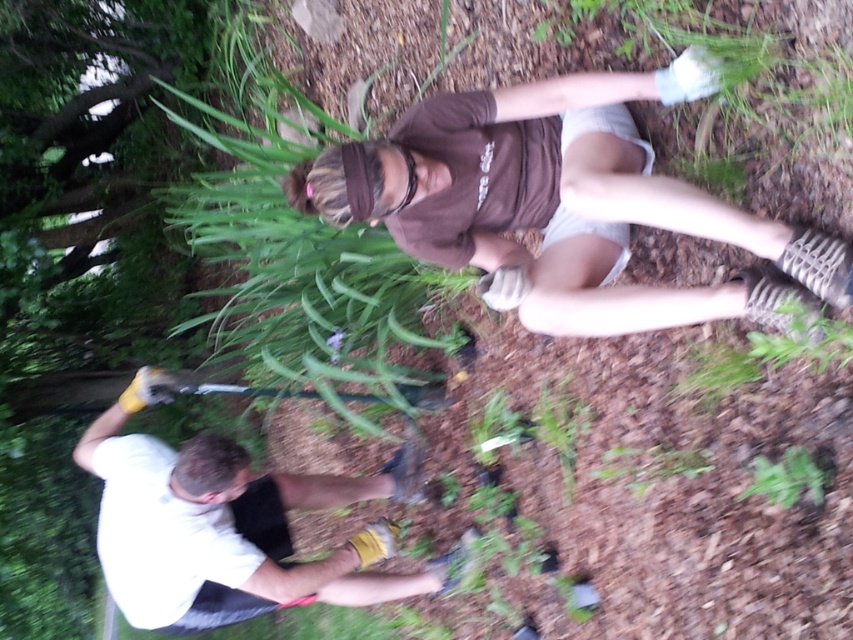
Question: Which object is farther from the camera taking this photo?

Choices:
 (A) white matte shirt at lower left
 (B) brown cotton shirt at upper center
 (C) green leafy plant at lower right

Answer: (A)

Question: Is brown cotton shirt at upper center behind white matte shirt at lower left?

Choices:
 (A) no
 (B) yes

Answer: (A)

Question: Which object is farther from the camera taking this photo?

Choices:
 (A) green leafy plant at lower right
 (B) white matte shirt at lower left
 (C) brown cotton shirt at upper center

Answer: (B)

Question: Is brown cotton shirt at upper center further to camera compared to green leafy plant at lower right?

Choices:
 (A) no
 (B) yes

Answer: (A)

Question: Which of the following is the farthest from the observer?

Choices:
 (A) (706, 308)
 (B) (799, 460)

Answer: (A)

Question: Considering the relative positions of brown cotton shirt at upper center and green leafy plant at lower right in the image provided, where is brown cotton shirt at upper center located with respect to green leafy plant at lower right?

Choices:
 (A) right
 (B) left

Answer: (B)